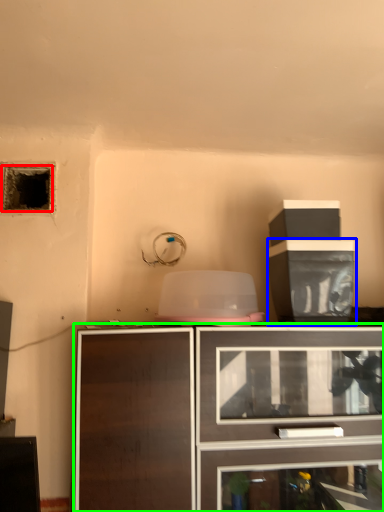
Question: Which is farther away from hole (highlighted by a red box)? cabinetry (highlighted by a blue box) or cabinetry (highlighted by a green box)?

Choices:
 (A) cabinetry
 (B) cabinetry

Answer: (B)